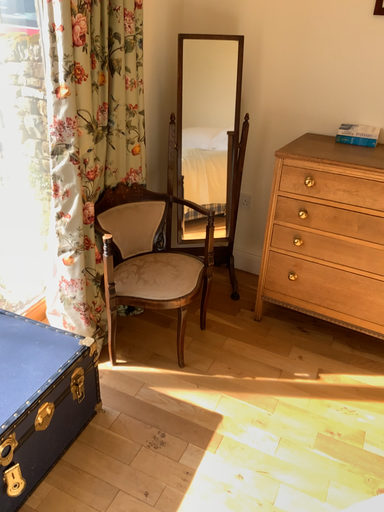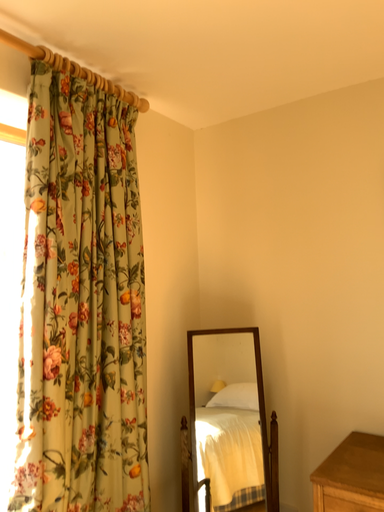
Question: How did the camera likely rotate when shooting the video?

Choices:
 (A) rotated upward
 (B) rotated downward

Answer: (A)